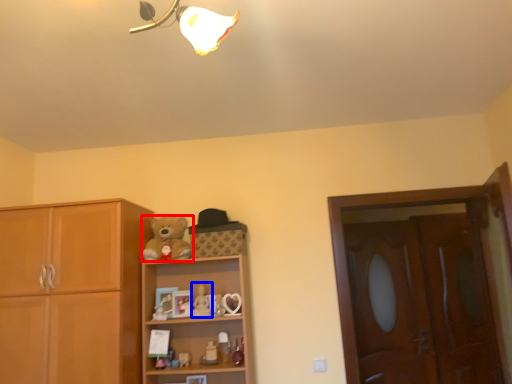
Question: Which point is further to the camera, teddy bear (highlighted by a red box) or toy (highlighted by a blue box)?

Choices:
 (A) teddy bear
 (B) toy

Answer: (B)